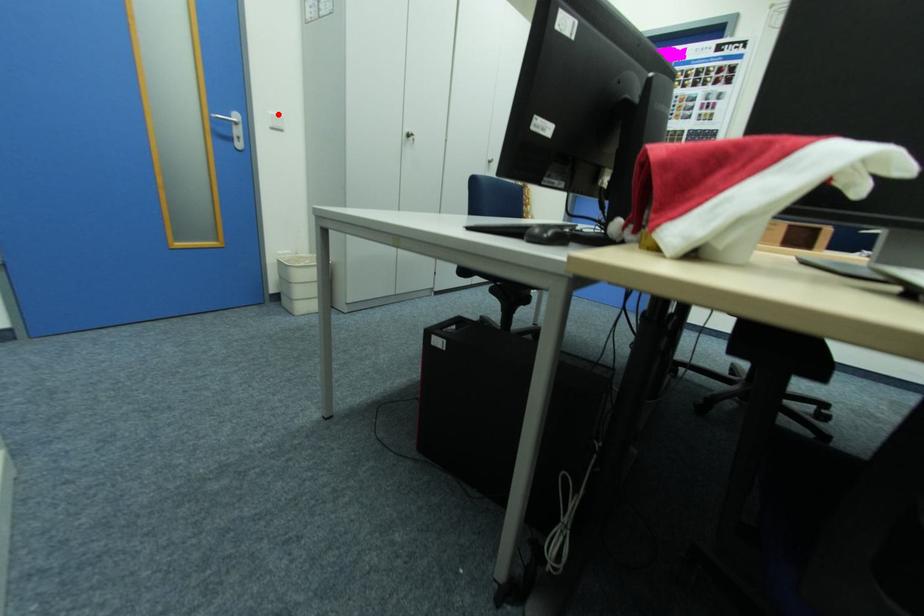
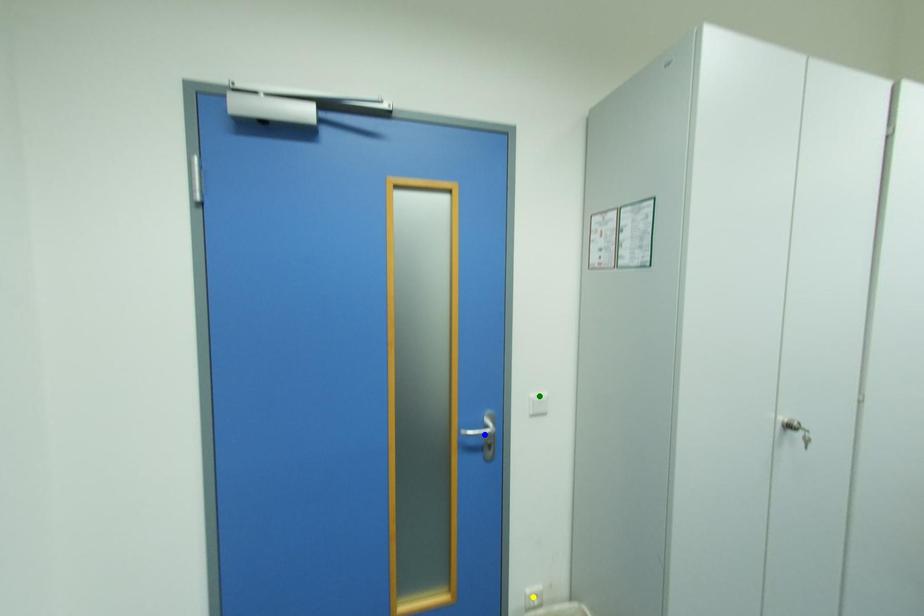
Question: I am providing you with two images of the same scene from different viewpoints. A red point is marked on the first image. You are given multiple points on the second image. Which mark in image 2 goes with the point in image 1?

Choices:
 (A) blue point
 (B) green point
 (C) yellow point

Answer: (B)